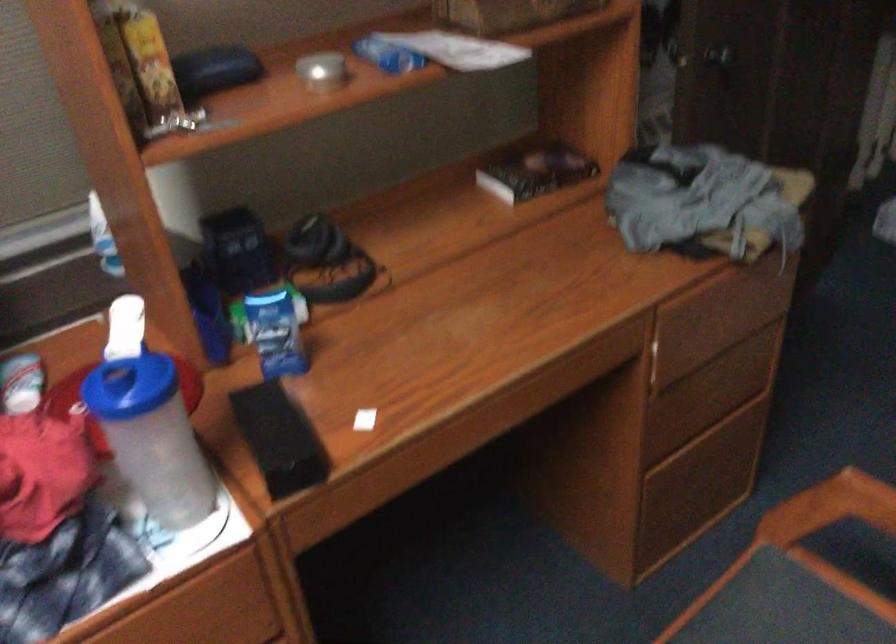
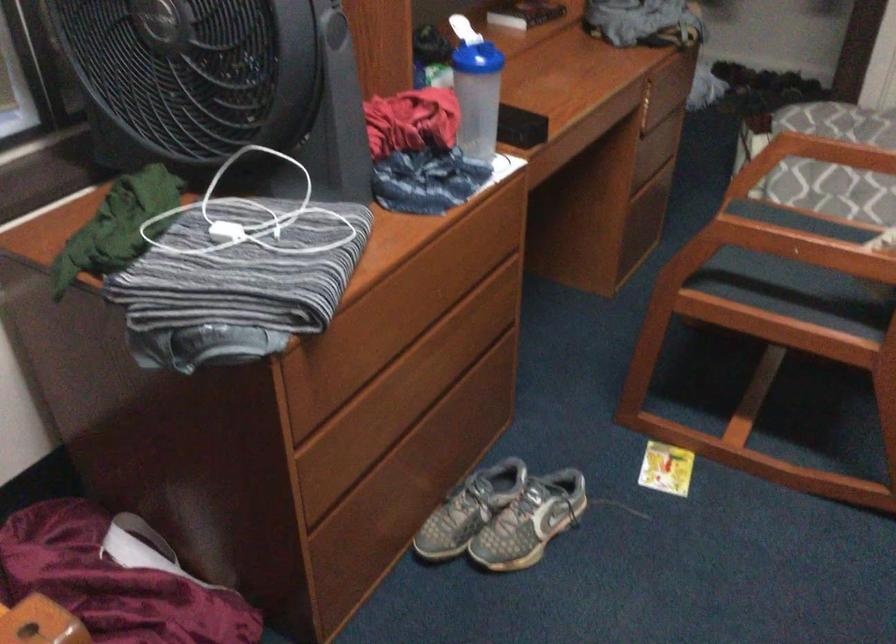
Locate, in the second image, the point that corresponds to pixel 134 321 in the first image.

(462, 29)